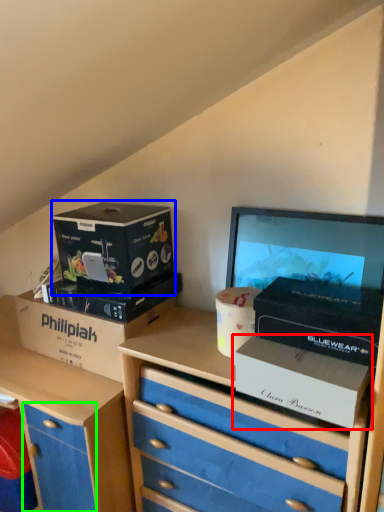
Question: Considering the real-world distances, which object is closest to box (highlighted by a red box)? box (highlighted by a blue box) or drawer (highlighted by a green box).

Choices:
 (A) box
 (B) drawer

Answer: (A)